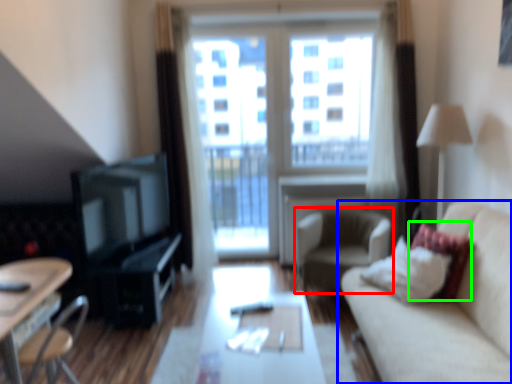
Question: Which object is positioned farthest from chair (highlighted by a red box)? Select from studio couch (highlighted by a blue box) and pillow (highlighted by a green box).

Choices:
 (A) studio couch
 (B) pillow

Answer: (A)